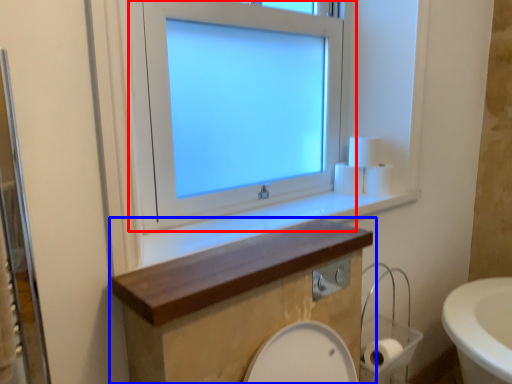
Question: Which object is closer to the camera taking this photo, window (highlighted by a red box) or bathroom cabinet (highlighted by a blue box)?

Choices:
 (A) window
 (B) bathroom cabinet

Answer: (B)